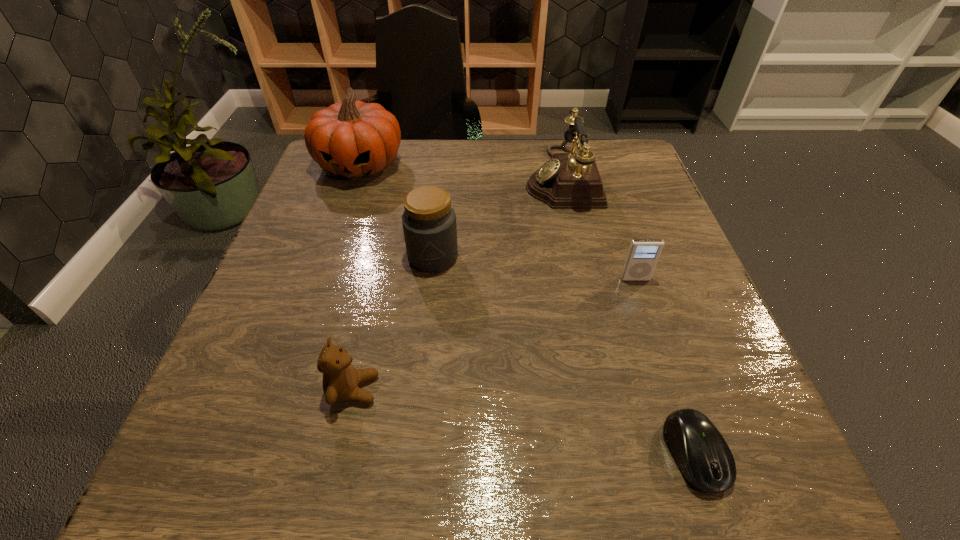
You are a GUI agent. You are given a task and a screenshot of the screen. Output one action in this format:
    pyautogui.click(x=<x>, y=<y>)
    Task: Click on the iPod that is at the right edge
    
    Given the screenshot: What is the action you would take?
    pyautogui.click(x=643, y=254)

Locate an element on the screen. This screenshot has width=960, height=540. mouse that is at the right edge is located at coordinates (704, 458).

Where is `object that is positioned at the far left corner`? This screenshot has height=540, width=960. object that is positioned at the far left corner is located at coordinates (353, 139).

I want to click on object positioned at the far right corner, so click(x=570, y=180).

Find the location of a particular element. The width and height of the screenshot is (960, 540). object present at the near right corner is located at coordinates (704, 458).

This screenshot has height=540, width=960. In the image, there is a desktop. What are the coordinates of `vacant space at the far edge` in the screenshot? It's located at (x=512, y=191).

Find the location of a particular element. Image resolution: width=960 pixels, height=540 pixels. free region at the near edge is located at coordinates (477, 460).

This screenshot has width=960, height=540. In the image, there is a desktop. Find the location of `free region at the left edge`. free region at the left edge is located at coordinates (277, 390).

At what (x,y) coordinates should I click in order to perform the action: click on vacant region at the right edge of the desktop. Please return your answer as a coordinate pair (x, y). This screenshot has height=540, width=960. Looking at the image, I should click on (691, 323).

In the image, there is a desktop. Where is `free region at the far left corner`? This screenshot has width=960, height=540. free region at the far left corner is located at coordinates (317, 166).